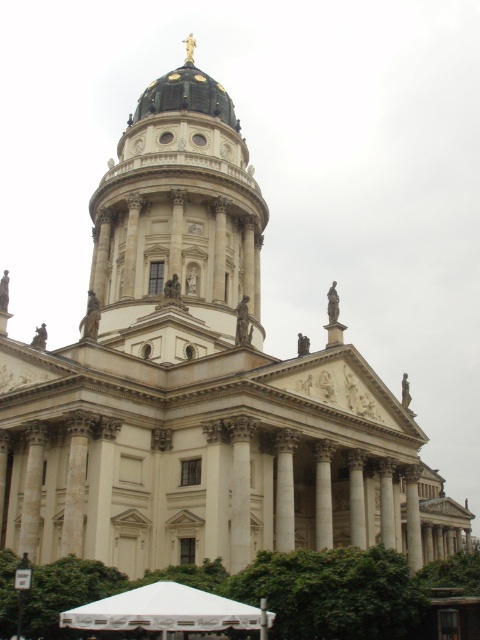
Is black dome at center further to the viewer compared to white fabric canopy at lower center?

Yes, it is.

Who is more forward, (242,262) or (192,600)?

Point (192,600) is in front.

Where is `black dome at center`? This screenshot has height=640, width=480. black dome at center is located at coordinates (178, 227).